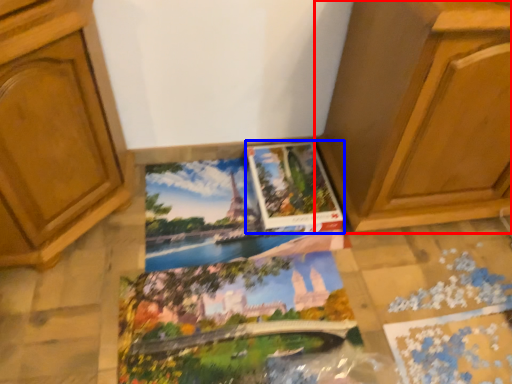
Question: Among these objects, which one is nearest to the camera, cabinetry (highlighted by a red box) or album (highlighted by a blue box)?

Choices:
 (A) cabinetry
 (B) album

Answer: (A)